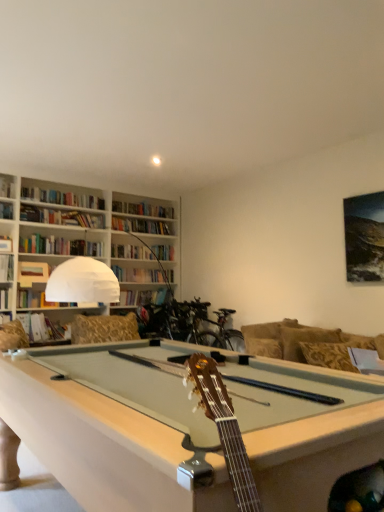
Question: From the image's perspective, is matte brown book at upper left, placed as the 3th book when sorted from top to bottom, positioned above or below white fabric pillow at right?

Choices:
 (A) below
 (B) above

Answer: (B)

Question: In terms of height, does matte brown book at upper left, acting as the second book starting from the bottom, look taller or shorter compared to white fabric pillow at right?

Choices:
 (A) tall
 (B) short

Answer: (B)

Question: Considering the real-world distances, which object is farthest from the hardcover book at center-left, arranged as the 1th book when ordered from the bottom?

Choices:
 (A) hardcover book at upper left, positioned as the fourth book in bottom-to-top order
 (B) matte brown book at upper left, placed as the 3th book when sorted from top to bottom
 (C) white fabric pillow at right
 (D) hardcover book at left, positioned as the second book in top-to-bottom order
 (E) gold-patterned fabric couch at right

Answer: (C)

Question: Which is nearer to the matte brown book at upper left, placed as the 3th book when sorted from top to bottom?

Choices:
 (A) white fabric pillow at right
 (B) hardcover book at upper left, which ranks as the first book in top-to-bottom order
 (C) gold-patterned fabric couch at right
 (D) hardcover book at center-left, arranged as the 1th book when ordered from the bottom
 (E) hardcover book at left, positioned as the second book in top-to-bottom order

Answer: (E)